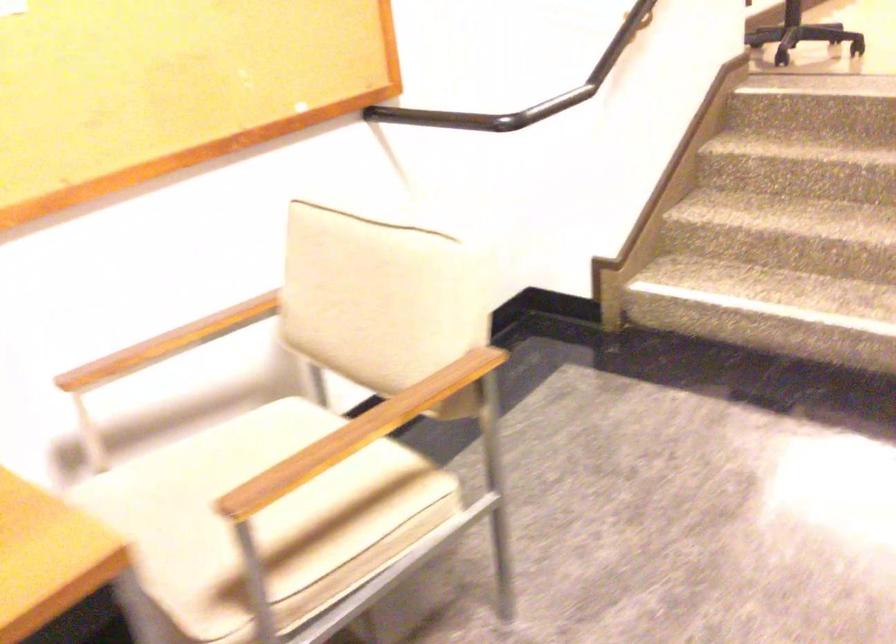
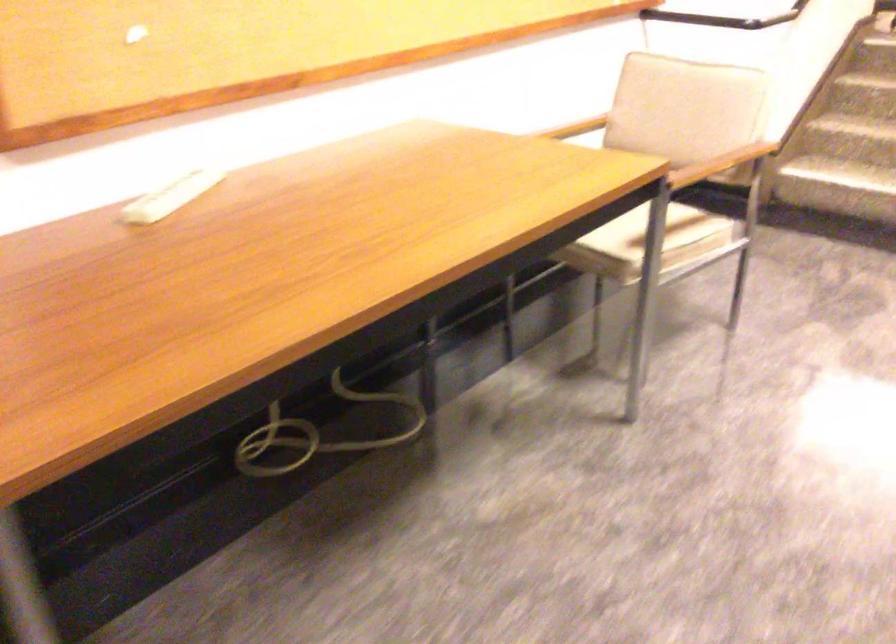
The point at (225, 323) is marked in the first image. Where is the corresponding point in the second image?

(574, 128)